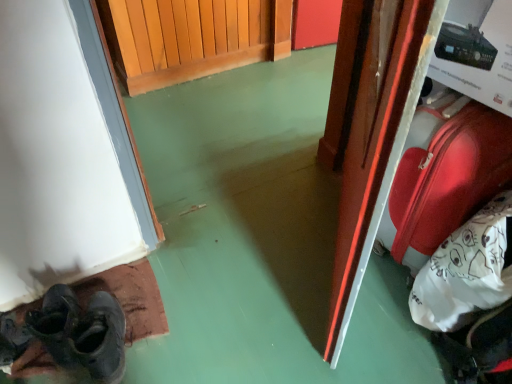
The height and width of the screenshot is (384, 512). I want to click on free area in between dark gray leather shoe at lower left and glossy wood door at right, so click(252, 286).